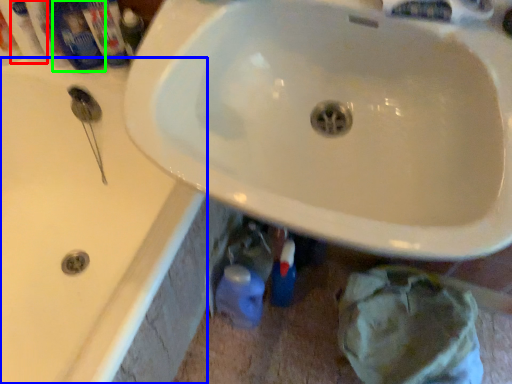
Question: Estimate the real-world distances between objects in this image. Which object is closer to mouthwash (highlighted by a red box), bath (highlighted by a blue box) or mouthwash (highlighted by a green box)?

Choices:
 (A) bath
 (B) mouthwash

Answer: (B)